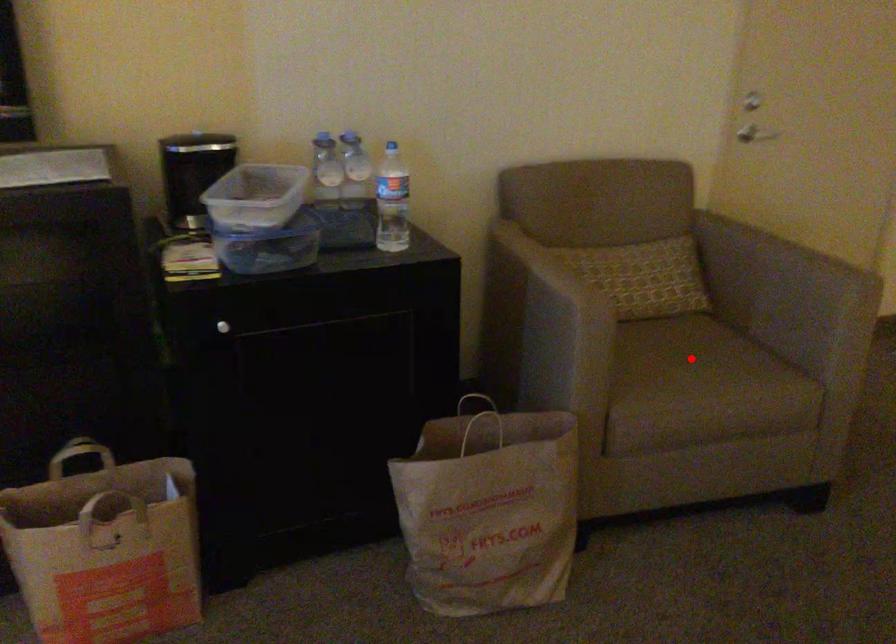
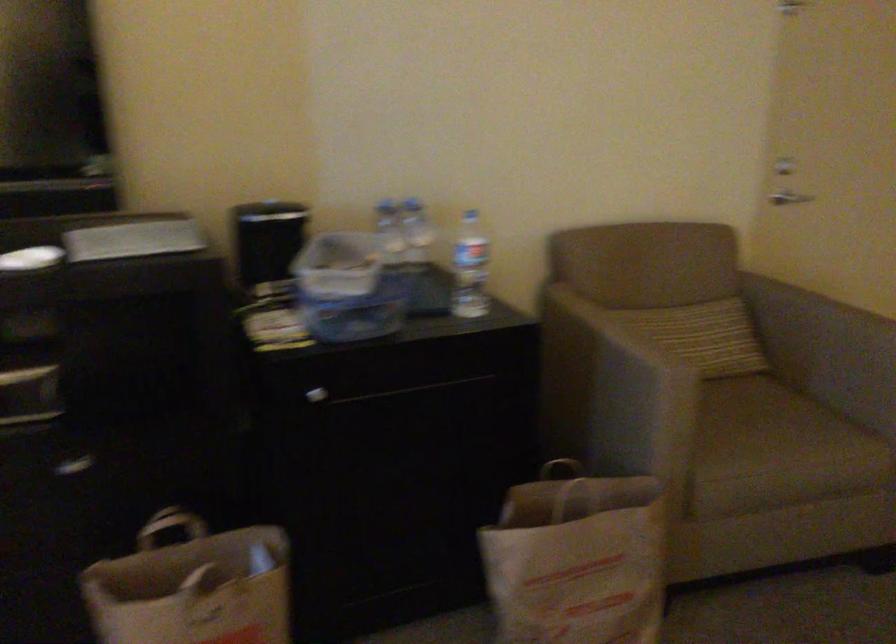
The point at the highlighted location is marked in the first image. Where is the corresponding point in the second image?

(762, 418)